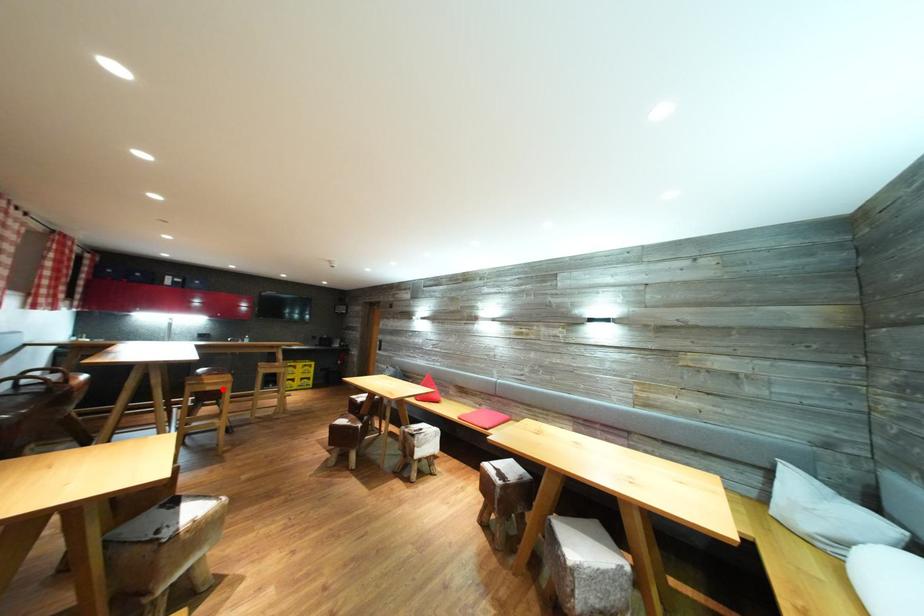
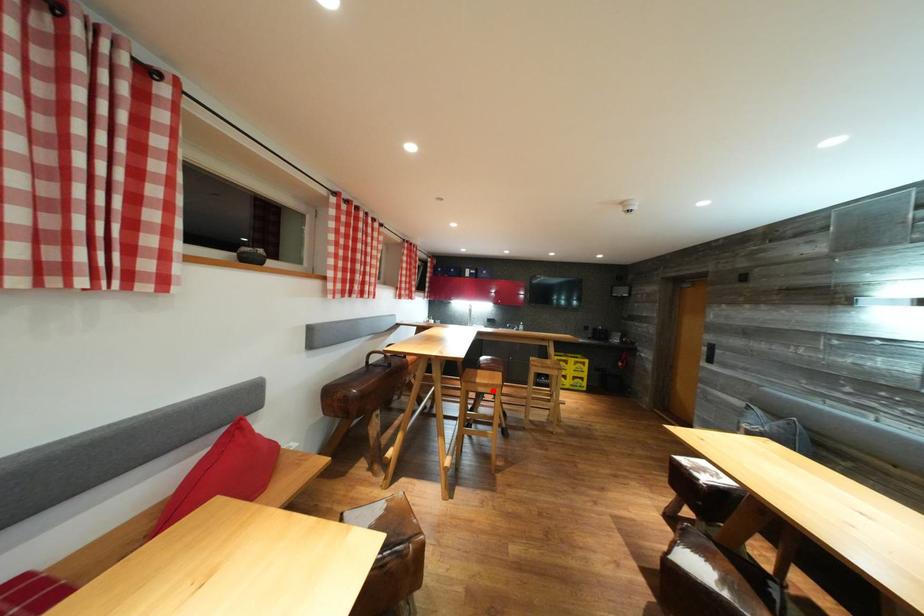
Consider the image. I am providing you with two images of the same scene from different viewpoints. A red point is marked on the first image and another point is marked on the second image. Is the marked point in image1 the same physical position as the marked point in image2?

Yes